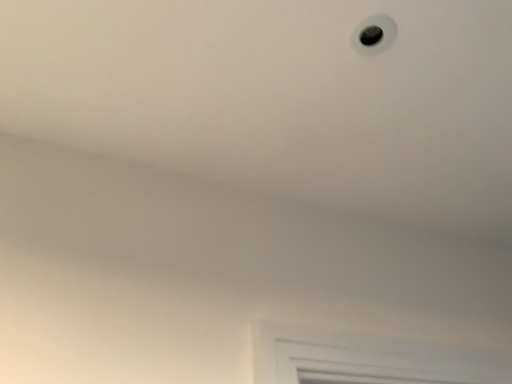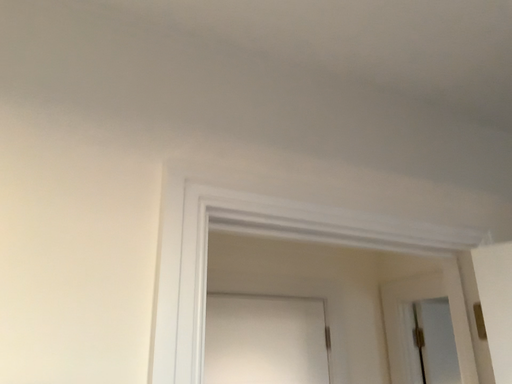
Question: How did the camera likely rotate when shooting the video?

Choices:
 (A) rotated downward
 (B) rotated upward

Answer: (A)